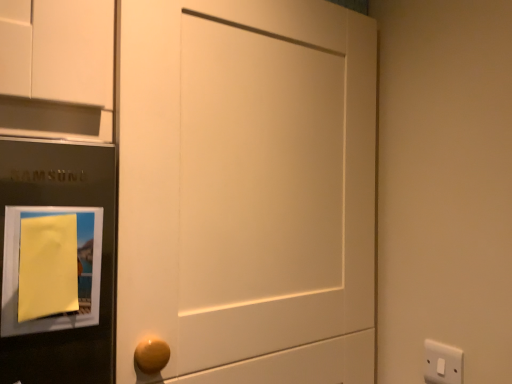
Question: From the image's perspective, is white plastic light switch at lower right on top of yellow matte paper at left?

Choices:
 (A) yes
 (B) no

Answer: (B)

Question: Is white plastic light switch at lower right smaller than yellow matte paper at left?

Choices:
 (A) yes
 (B) no

Answer: (A)

Question: Would you consider white plastic light switch at lower right to be distant from yellow matte paper at left?

Choices:
 (A) yes
 (B) no

Answer: (B)

Question: Considering the relative sizes of white plastic light switch at lower right and yellow matte paper at left in the image provided, is white plastic light switch at lower right bigger than yellow matte paper at left?

Choices:
 (A) no
 (B) yes

Answer: (A)

Question: From the image's perspective, is white plastic light switch at lower right below yellow matte paper at left?

Choices:
 (A) yes
 (B) no

Answer: (A)

Question: Considering the relative positions of white plastic light switch at lower right and yellow matte paper at left in the image provided, is white plastic light switch at lower right to the left of yellow matte paper at left from the viewer's perspective?

Choices:
 (A) no
 (B) yes

Answer: (A)

Question: Is yellow matte paper at left far from white plastic light switch at lower right?

Choices:
 (A) no
 (B) yes

Answer: (A)

Question: From the image's perspective, is yellow matte paper at left on top of white plastic light switch at lower right?

Choices:
 (A) no
 (B) yes

Answer: (B)

Question: Is yellow matte paper at left in front of white plastic light switch at lower right?

Choices:
 (A) no
 (B) yes

Answer: (B)

Question: Can you confirm if yellow matte paper at left is bigger than white plastic light switch at lower right?

Choices:
 (A) no
 (B) yes

Answer: (B)

Question: Does yellow matte paper at left appear on the right side of white plastic light switch at lower right?

Choices:
 (A) yes
 (B) no

Answer: (B)

Question: Considering the relative positions of yellow matte paper at left and white plastic light switch at lower right in the image provided, is yellow matte paper at left to the left of white plastic light switch at lower right from the viewer's perspective?

Choices:
 (A) yes
 (B) no

Answer: (A)

Question: Would you say yellow matte paper at left is inside or outside white plastic light switch at lower right?

Choices:
 (A) outside
 (B) inside

Answer: (A)